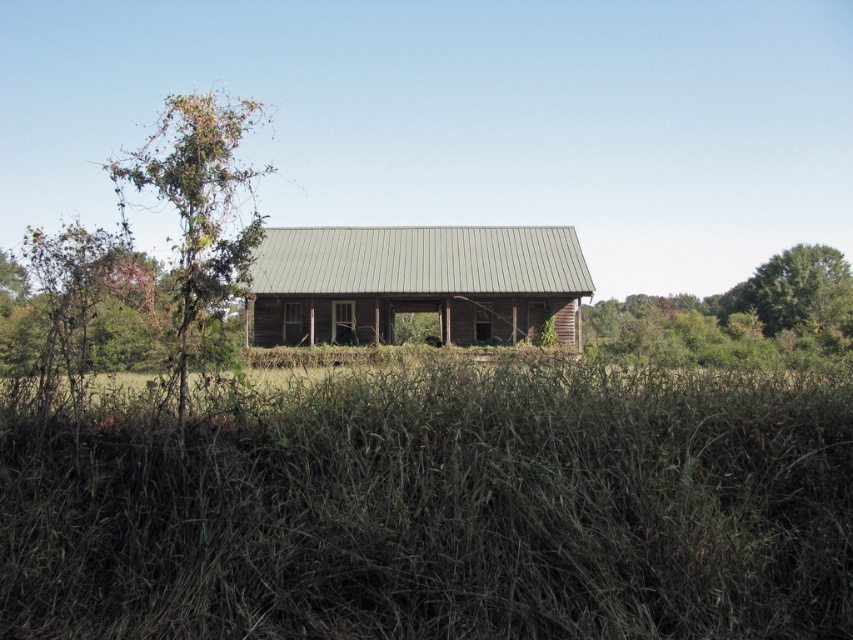
Can you confirm if green rough grass at center is positioned below green leafy tree at right?

Yes, green rough grass at center is below green leafy tree at right.

Is green rough grass at center positioned at the back of green leafy tree at right?

That is False.

Between point (584, 532) and point (833, 317), which one is positioned behind?

The point (833, 317) is more distant.

Where is `green rough grass at center`? The image size is (853, 640). green rough grass at center is located at coordinates (434, 508).

Who is shorter, green leafy tree at right or green leafy tree at left?

green leafy tree at right is shorter.

Is the position of green leafy tree at right more distant than that of green leafy tree at left?

Yes, it is behind green leafy tree at left.

Is point (780, 307) in front of point (242, 268)?

That is False.

You are a GUI agent. You are given a task and a screenshot of the screen. Output one action in this format:
    pyautogui.click(x=<x>, y=<y>)
    Task: Click on the green leafy tree at right
    
    Given the screenshot: What is the action you would take?
    pyautogui.click(x=740, y=317)

Does green rough grass at center have a lesser width compared to green leafy tree at upper right?

Yes.

Which is above, green rough grass at center or green leafy tree at upper right?

Positioned higher is green leafy tree at upper right.

Who is more distant from viewer, (831, 592) or (825, 260)?

Point (825, 260)

Image resolution: width=853 pixels, height=640 pixels. Identify the location of green rough grass at center. (434, 508).